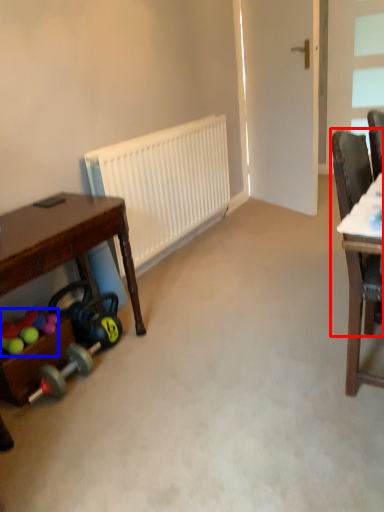
Question: Which object appears farthest to the camera in this image, chair (highlighted by a red box) or toy (highlighted by a blue box)?

Choices:
 (A) chair
 (B) toy

Answer: (B)